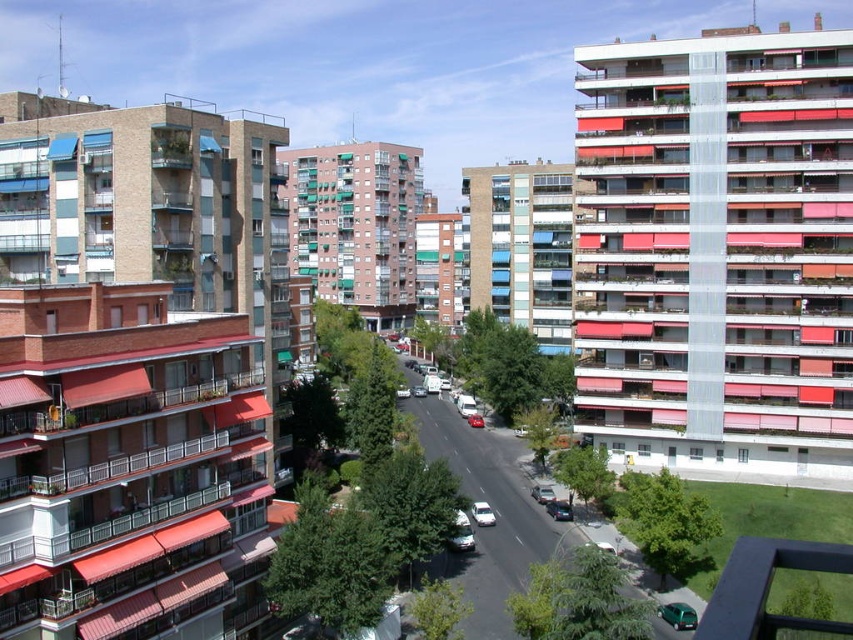
Which of these two, white matte car at center or metallic silver car at center, stands shorter?

With less height is metallic silver car at center.

Is white matte car at center bigger than metallic silver car at center?

Yes.

The image size is (853, 640). What do you see at coordinates (482, 513) in the screenshot?
I see `white matte car at center` at bounding box center [482, 513].

Locate an element on the screen. Image resolution: width=853 pixels, height=640 pixels. white matte car at center is located at coordinates (482, 513).

Is metallic silver car at center thinner than metallic silver sedan at center?

No.

Is metallic silver car at center taller than metallic silver sedan at center?

Yes, metallic silver car at center is taller than metallic silver sedan at center.

The image size is (853, 640). Describe the element at coordinates (560, 509) in the screenshot. I see `metallic silver car at center` at that location.

This screenshot has width=853, height=640. I want to click on metallic silver car at center, so point(560,509).

Is point (722, 300) more distant than point (553, 518)?

Yes, point (722, 300) is farther from viewer.

Based on the photo, is the position of metallic silver balcony at upper right less distant than that of metallic silver car at center?

That is False.

You are a GUI agent. You are given a task and a screenshot of the screen. Output one action in this format:
    pyautogui.click(x=<x>, y=<y>)
    Task: Click on the metallic silver balcony at upper right
    
    Given the screenshot: What is the action you would take?
    pyautogui.click(x=715, y=248)